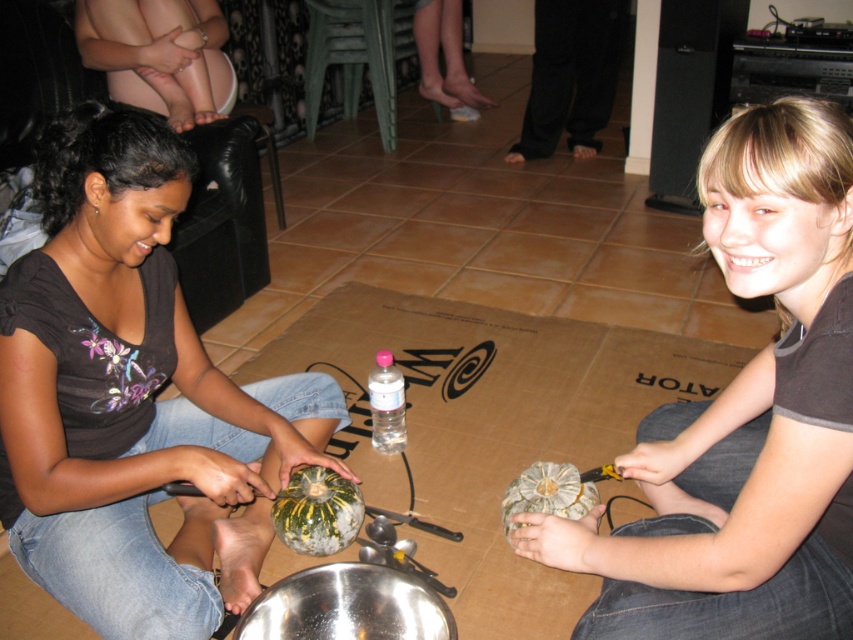
From the picture: Is matte green pumpkin at lower center taller than smooth skin at upper left?

Yes.

The width and height of the screenshot is (853, 640). What do you see at coordinates (746, 417) in the screenshot?
I see `matte green pumpkin at lower center` at bounding box center [746, 417].

Which is behind, point (721, 573) or point (157, 35)?

The point (157, 35) is behind.

At what (x,y) coordinates should I click in order to perform the action: click on matte green pumpkin at lower center. Please return your answer as a coordinate pair (x, y). The image size is (853, 640). Looking at the image, I should click on (746, 417).

Is matte green pumpkin at lower center further to the viewer compared to green textured gourd at lower center?

No, matte green pumpkin at lower center is in front of green textured gourd at lower center.

Between matte green pumpkin at lower center and green textured gourd at lower center, which one appears on the right side from the viewer's perspective?

matte green pumpkin at lower center is more to the right.

Which is behind, point (700, 424) or point (532, 461)?

The point (532, 461) is behind.

Identify the location of matte green pumpkin at lower center. The height and width of the screenshot is (640, 853). (746, 417).

Is point (115, 51) farther from camera compared to point (393, 365)?

Yes.

Is smooth skin at upper left bigger than clear plastic bottle at center?

Yes, smooth skin at upper left is bigger than clear plastic bottle at center.

Who is more distant from viewer, (84, 12) or (402, 400)?

Point (84, 12)

Identify the location of smooth skin at upper left. (160, 54).